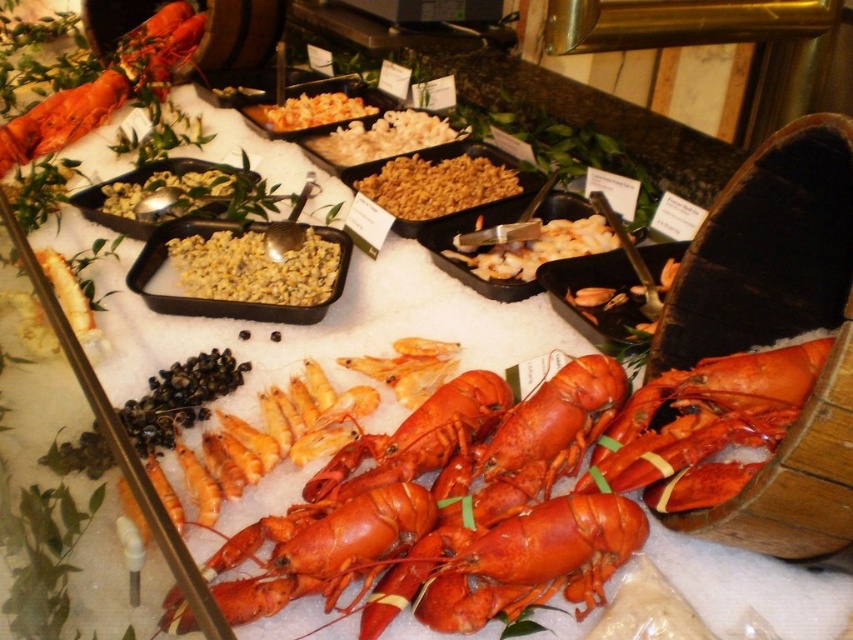
Between yellow corn at center and golden crispy rice at center, which one has more height?

Standing taller between the two is golden crispy rice at center.

Which of these two, yellow corn at center or golden crispy rice at center, stands shorter?

Standing shorter between the two is yellow corn at center.

Is point (221, 294) closer to camera compared to point (419, 161)?

Yes, point (221, 294) is closer to viewer.

Locate an element on the screen. Image resolution: width=853 pixels, height=640 pixels. yellow corn at center is located at coordinates (254, 268).

Who is more distant from viewer, (732, 440) or (415, 157)?

The point (415, 157) is behind.

Is shiny red lobster at center shorter than golden crispy rice at center?

In fact, shiny red lobster at center may be taller than golden crispy rice at center.

Which is in front, point (445, 541) or point (505, 180)?

Positioned in front is point (445, 541).

Identify the location of shiny red lobster at center. The height and width of the screenshot is (640, 853). (488, 522).

Can you confirm if shiny red lobster at center is positioned above yellow matte corn at center?

Incorrect, shiny red lobster at center is not positioned above yellow matte corn at center.

Who is positioned more to the left, shiny red lobster at center or yellow matte corn at center?

yellow matte corn at center

Who is more forward, (621,513) or (173,202)?

Point (621,513) is more forward.

The width and height of the screenshot is (853, 640). Find the location of `shiny red lobster at center`. shiny red lobster at center is located at coordinates coord(488,522).